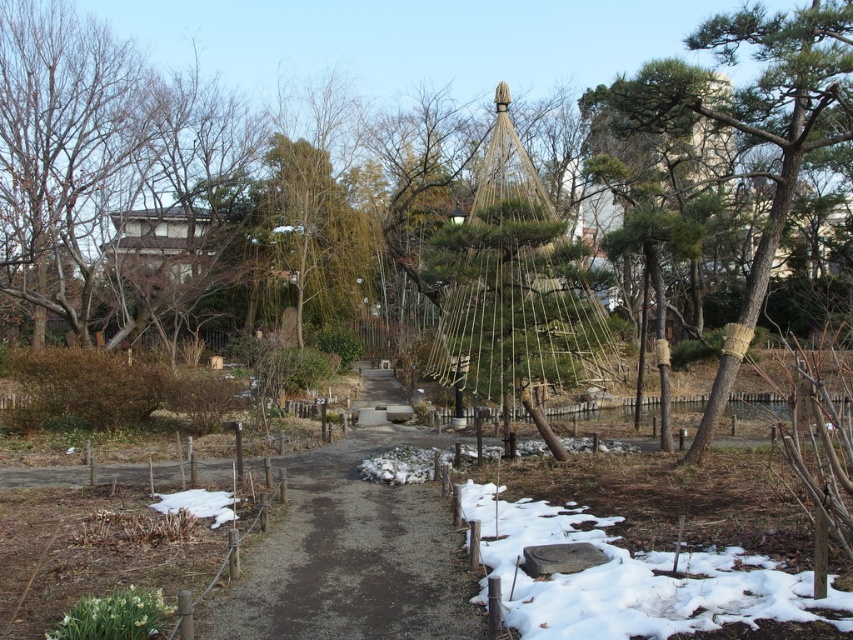
You are a gardener planning to walk along the dirt path at center while avoiding the brown rough bark tree at right. Can you walk through the path without getting too close to the tree?

The dirt path at center is thinner than the brown rough bark tree at right, so there is limited space between them. You may need to walk carefully to avoid getting too close to the tree.

You are a park visitor standing on the paved pathway and want to walk towards both the point at coordinates point (349, 486) and point (498, 552). Which point will you reach first?

You will reach point (349, 486) first because it is closer to you than point (498, 552), which is further away.

You are standing at the center of the paved pathway in the park. You see a point marked at coordinates (x=749, y=128). What object does this point correspond to?

The point at coordinates (x=749, y=128) corresponds to the brown rough bark tree at right.